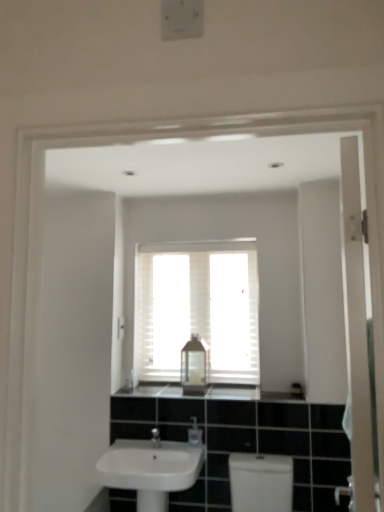
Question: Would you consider white matte window at center to be distant from white glossy toilet at lower center?

Choices:
 (A) no
 (B) yes

Answer: (A)

Question: Considering the relative sizes of white matte window at center and white glossy toilet at lower center in the image provided, is white matte window at center smaller than white glossy toilet at lower center?

Choices:
 (A) no
 (B) yes

Answer: (B)

Question: Considering the relative sizes of white matte window at center and white glossy toilet at lower center in the image provided, is white matte window at center shorter than white glossy toilet at lower center?

Choices:
 (A) yes
 (B) no

Answer: (B)

Question: Is the depth of white matte window at center less than that of white glossy toilet at lower center?

Choices:
 (A) no
 (B) yes

Answer: (A)

Question: Is white matte window at center further to the viewer compared to white glossy toilet at lower center?

Choices:
 (A) no
 (B) yes

Answer: (B)

Question: Is white matte window at center outside of white glossy toilet at lower center?

Choices:
 (A) no
 (B) yes

Answer: (B)

Question: Can you confirm if white plastic light switch at upper center is smaller than black granite countertop at center?

Choices:
 (A) no
 (B) yes

Answer: (B)

Question: Would you say black granite countertop at center is part of white plastic light switch at upper center's contents?

Choices:
 (A) yes
 (B) no

Answer: (B)

Question: Considering the relative sizes of white plastic light switch at upper center and black granite countertop at center in the image provided, is white plastic light switch at upper center bigger than black granite countertop at center?

Choices:
 (A) no
 (B) yes

Answer: (A)

Question: Considering the relative sizes of white plastic light switch at upper center and black granite countertop at center in the image provided, is white plastic light switch at upper center thinner than black granite countertop at center?

Choices:
 (A) no
 (B) yes

Answer: (B)

Question: Considering the relative positions of white plastic light switch at upper center and black granite countertop at center in the image provided, is white plastic light switch at upper center behind black granite countertop at center?

Choices:
 (A) yes
 (B) no

Answer: (A)

Question: Considering the relative positions of white plastic light switch at upper center and black granite countertop at center in the image provided, is white plastic light switch at upper center to the right of black granite countertop at center from the viewer's perspective?

Choices:
 (A) no
 (B) yes

Answer: (A)

Question: Is white plastic light switch at upper center at the back of white matte window at center?

Choices:
 (A) yes
 (B) no

Answer: (B)